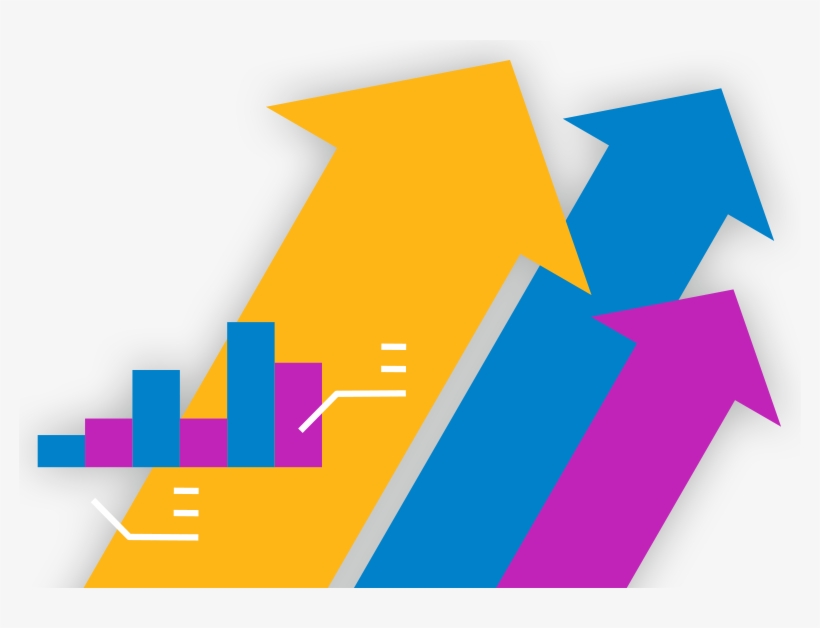
You are a GUI agent. You are given a task and a screenshot of the screen. Output one action in this format:
    pyautogui.click(x=<x>, y=<y>)
    Task: Click on the bars
    This screenshot has height=628, width=820.
    Given the screenshot: What is the action you would take?
    pyautogui.click(x=64, y=443), pyautogui.click(x=112, y=431), pyautogui.click(x=158, y=407), pyautogui.click(x=201, y=441), pyautogui.click(x=263, y=382), pyautogui.click(x=301, y=398)